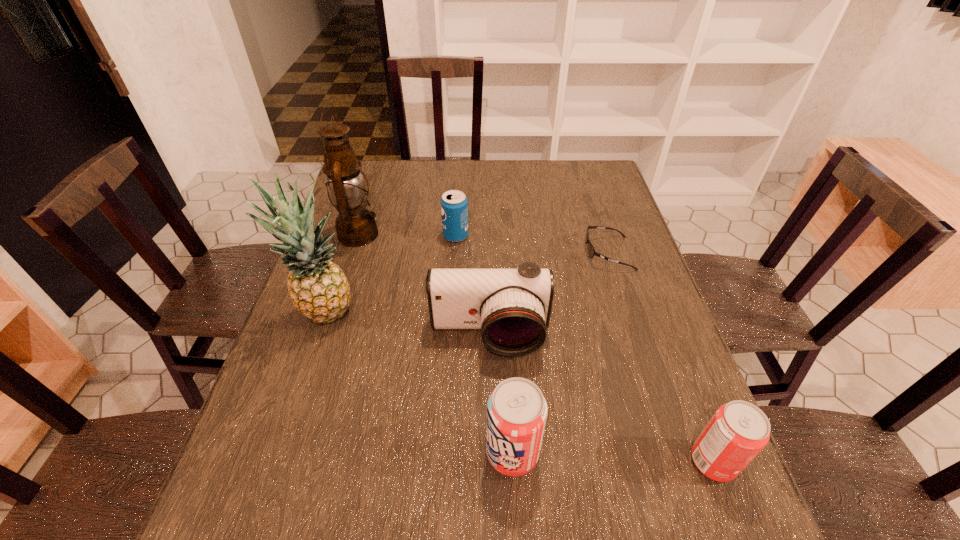
At what (x,y) coordinates should I click in order to perform the action: click on vacant space located on the back of the oil lamp. Please return your answer as a coordinate pair (x, y). Image resolution: width=960 pixels, height=540 pixels. Looking at the image, I should click on (382, 160).

At what (x,y) coordinates should I click in order to perform the action: click on vacant space located 0.130m on the front-facing side of the sunglasses. Please return your answer as a coordinate pair (x, y). Image resolution: width=960 pixels, height=540 pixels. Looking at the image, I should click on (540, 253).

This screenshot has height=540, width=960. I want to click on vacant space situated on the front-facing side of the sunglasses, so click(x=530, y=253).

Find the location of a particular element. Image resolution: width=960 pixels, height=540 pixels. free space located on the front-facing side of the sunglasses is located at coordinates (513, 253).

This screenshot has width=960, height=540. Identify the location of vacant space located 0.360m on the back of the pineapple. (360, 213).

Locate an element on the screen. The height and width of the screenshot is (540, 960). vacant region located on the surface of the camcorder is located at coordinates (491, 427).

Locate an element on the screen. oil lamp that is at the left edge is located at coordinates (355, 226).

Where is `pineapple that is positioned at the left edge`? This screenshot has width=960, height=540. pineapple that is positioned at the left edge is located at coordinates (318, 288).

I want to click on soda can situated at the right edge, so click(738, 431).

Locate an element on the screen. The height and width of the screenshot is (540, 960). sunglasses situated at the right edge is located at coordinates (591, 251).